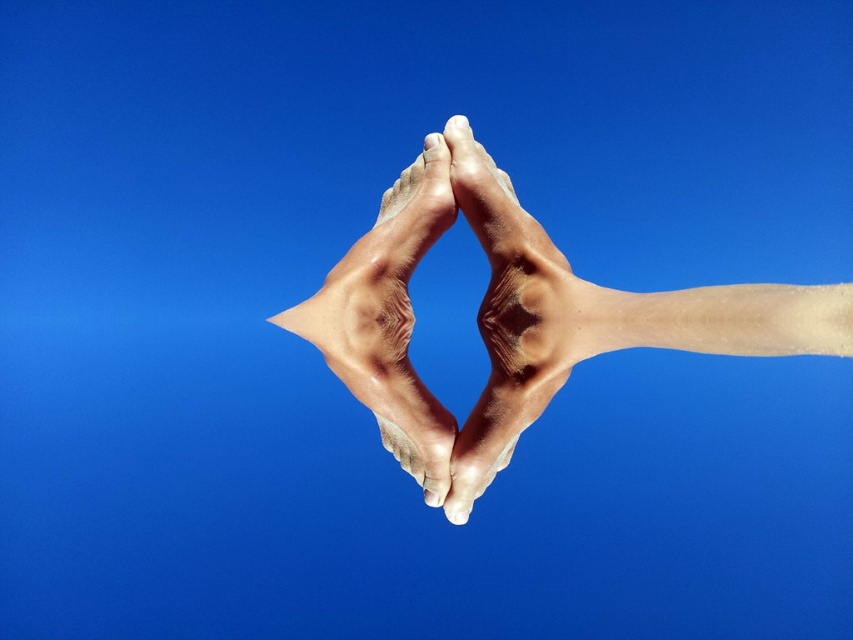
Question: Does smooth skin feet at center appear over smooth skin hand at center?

Choices:
 (A) no
 (B) yes

Answer: (B)

Question: Is smooth skin feet at center below smooth skin hand at center?

Choices:
 (A) yes
 (B) no

Answer: (B)

Question: Can you confirm if smooth skin feet at center is positioned to the right of smooth skin hand at center?

Choices:
 (A) yes
 (B) no

Answer: (A)

Question: Which of the following is the closest to the observer?

Choices:
 (A) (462, 452)
 (B) (389, 208)

Answer: (A)